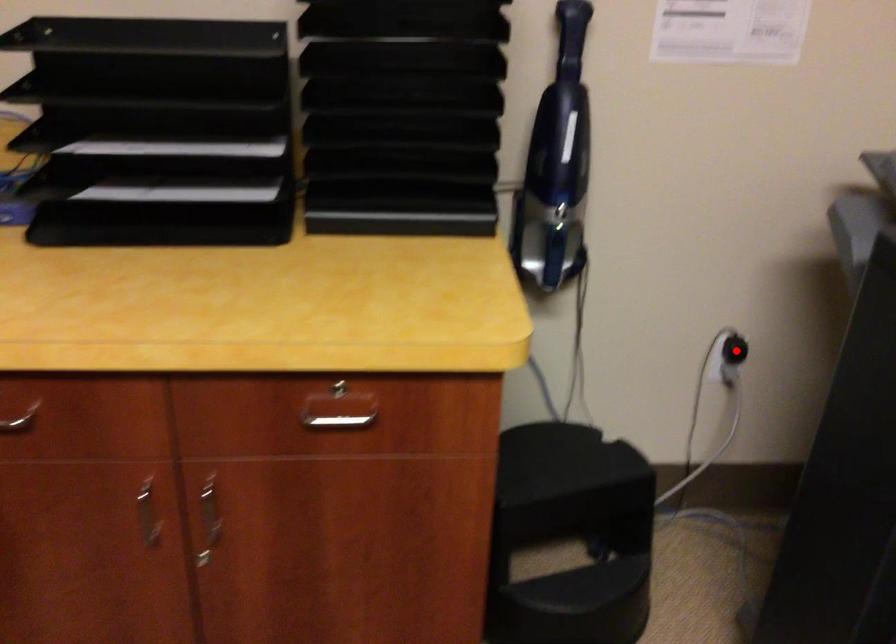
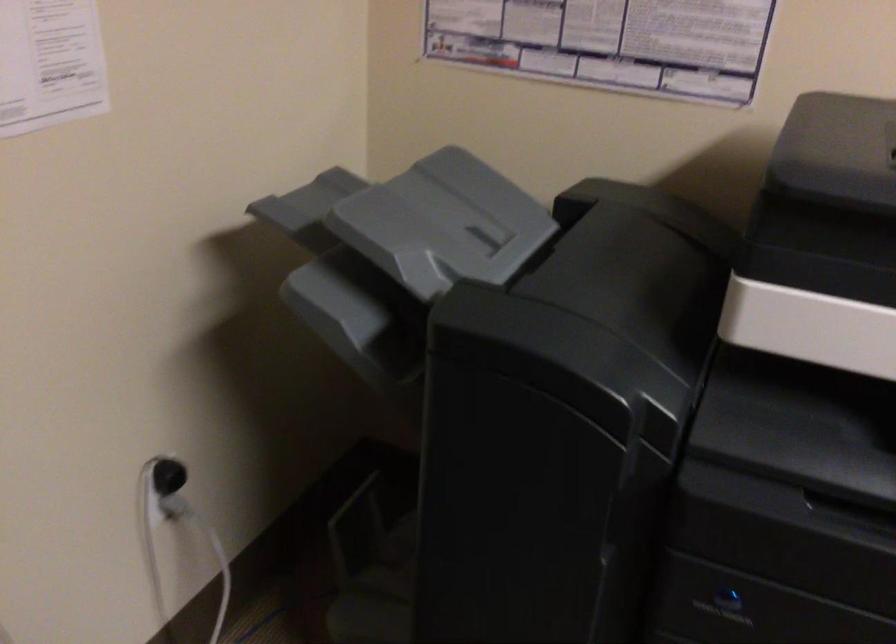
The point at the highlighted location is marked in the first image. Where is the corresponding point in the second image?

(168, 476)